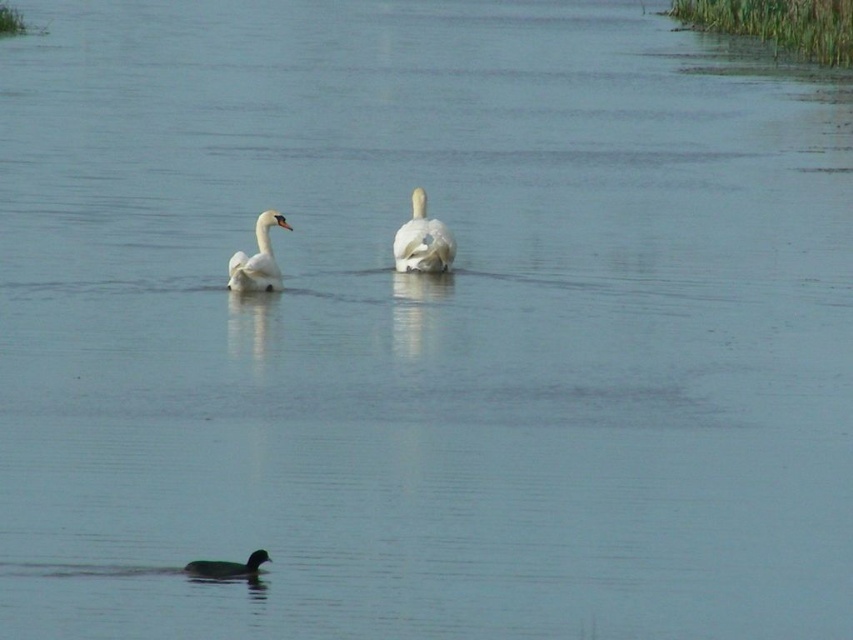
Does white feathered swan at center have a lesser height compared to dark brown matte duck at lower center?

No.

Consider the image. Can you confirm if white feathered swan at center is bigger than dark brown matte duck at lower center?

Correct, white feathered swan at center is larger in size than dark brown matte duck at lower center.

Who is more distant from viewer, (265,259) or (233,566)?

The point (265,259) is more distant.

In order to click on white feathered swan at center in this screenshot , I will do `click(257, 259)`.

Does white glossy swan at center appear over dark brown matte duck at lower center?

Indeed, white glossy swan at center is positioned over dark brown matte duck at lower center.

Between white glossy swan at center and dark brown matte duck at lower center, which one has more height?

white glossy swan at center

Between point (433, 268) and point (202, 563), which one is positioned behind?

The point (433, 268) is behind.

The height and width of the screenshot is (640, 853). I want to click on white glossy swan at center, so click(422, 241).

Based on the photo, can you confirm if white glossy swan at center is positioned to the right of white feathered swan at center?

Correct, you'll find white glossy swan at center to the right of white feathered swan at center.

Describe the element at coordinates (422, 241) in the screenshot. I see `white glossy swan at center` at that location.

Is point (428, 248) positioned behind point (235, 269)?

Yes, it is.

Find the location of a particular element. Image resolution: width=853 pixels, height=640 pixels. white glossy swan at center is located at coordinates (422, 241).